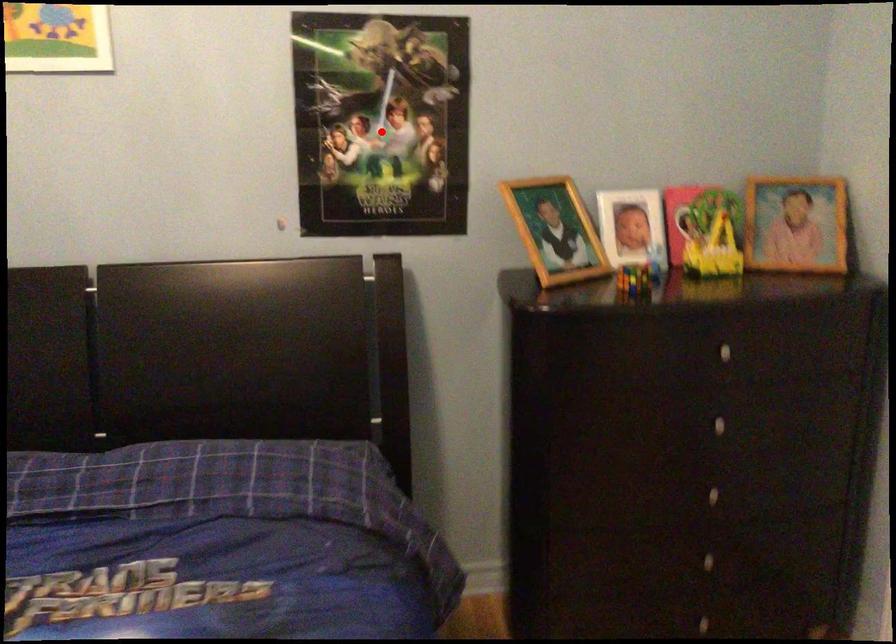
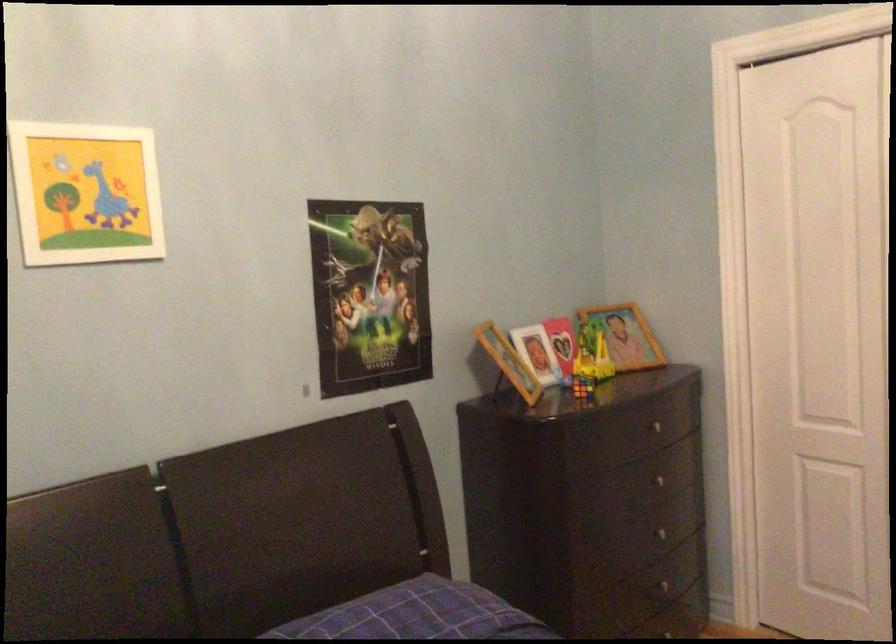
Locate, in the second image, the point that corresponds to the highlighted location in the first image.

(369, 294)